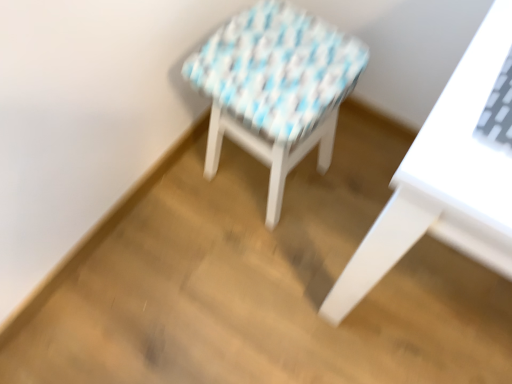
Identify the location of vacant space situated above white woven stool at center (from a real-world perspective). tap(277, 57).